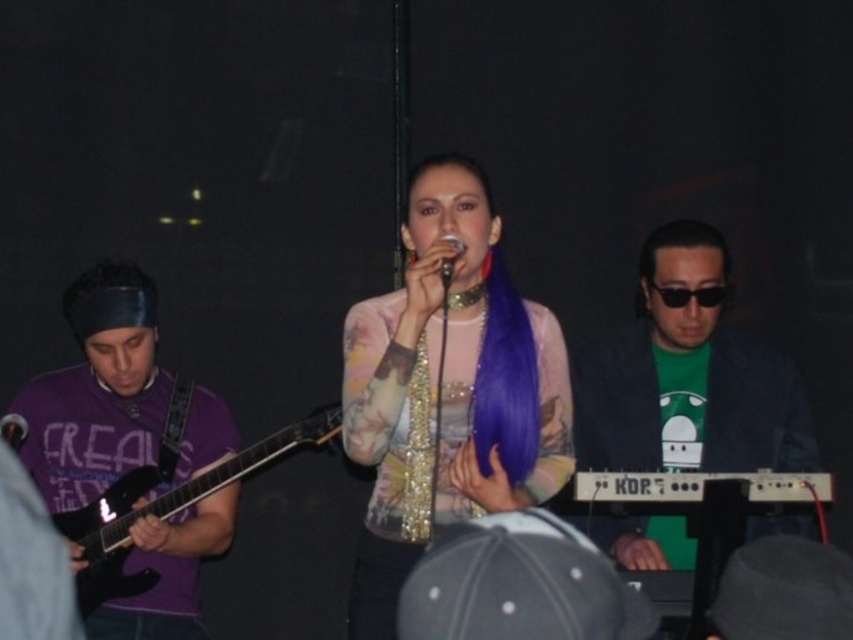
You are a photographer at the back of the stage trying to capture the purple shiny hair at center and the metallic silver microphone at center in the same frame. Which object appears wider in your photo?

The purple shiny hair at center appears wider in the photo because its width surpasses that of the metallic silver microphone at center.

You are a stage technician adjusting the lighting for the performance. You need to position a spotlight directly above the metallic silver microphone at center. According to the stage coordinates, where should you place the spotlight?

The metallic silver microphone at center is located at point [13,429], so the spotlight should be placed directly above this coordinate to illuminate it properly.